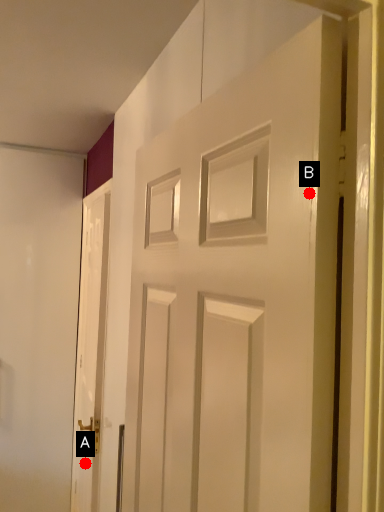
Question: Two points are circled on the image, labeled by A and B beside each circle. Among these points, which one is farthest from the camera?

Choices:
 (A) A is further
 (B) B is further

Answer: (A)